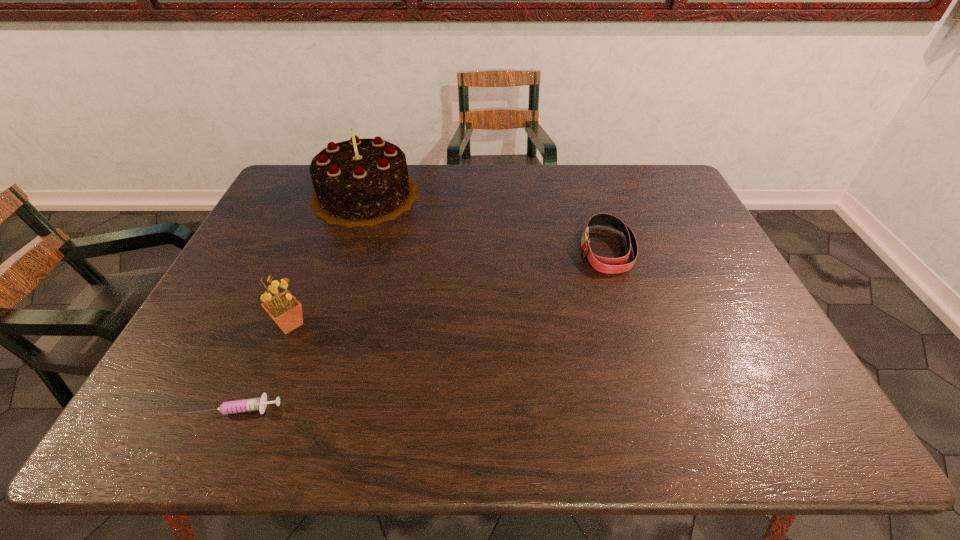
Where is `vacant space situated on the back of the syringe`? The width and height of the screenshot is (960, 540). vacant space situated on the back of the syringe is located at coordinates (297, 270).

At what (x,y) coordinates should I click in order to perform the action: click on object at the far edge. Please return your answer as a coordinate pair (x, y). Looking at the image, I should click on (360, 182).

Image resolution: width=960 pixels, height=540 pixels. I want to click on object present at the near edge, so click(x=253, y=404).

Identify the location of birthday cake that is at the left edge. This screenshot has height=540, width=960. (360, 182).

The image size is (960, 540). I want to click on syringe present at the left edge, so click(253, 404).

Identify the location of object at the far left corner. This screenshot has width=960, height=540. (360, 182).

Find the location of a particular element. The image size is (960, 540). object that is positioned at the near left corner is located at coordinates (253, 404).

The image size is (960, 540). In the image, there is a desktop. What are the coordinates of `blank space at the far edge` in the screenshot? It's located at (582, 179).

The height and width of the screenshot is (540, 960). In order to click on free space at the near edge in this screenshot , I will do `click(592, 434)`.

You are a GUI agent. You are given a task and a screenshot of the screen. Output one action in this format:
    pyautogui.click(x=<x>, y=<y>)
    Task: Click on the vacant area at the left edge
    
    Given the screenshot: What is the action you would take?
    pyautogui.click(x=290, y=222)